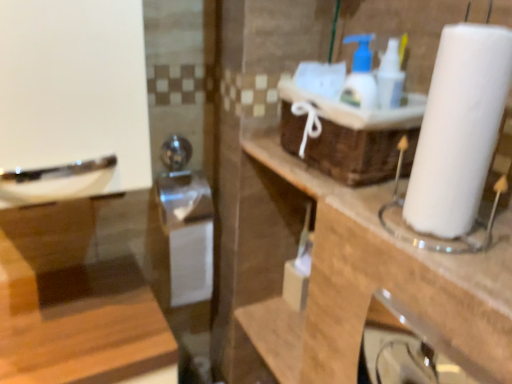
Question: Considering the relative positions of white paper at right and white paper towel at right in the image provided, is white paper at right behind white paper towel at right?

Choices:
 (A) yes
 (B) no

Answer: (B)

Question: Is white paper at right next to white paper towel at right and touching it?

Choices:
 (A) no
 (B) yes

Answer: (A)

Question: Does white paper at right have a lesser width compared to white paper towel at right?

Choices:
 (A) no
 (B) yes

Answer: (B)

Question: Is white paper at right not near white paper towel at right?

Choices:
 (A) no
 (B) yes

Answer: (A)

Question: From the image's perspective, is white paper at right below white paper towel at right?

Choices:
 (A) yes
 (B) no

Answer: (B)

Question: From the image's perspective, is white paper at right over white paper towel at right?

Choices:
 (A) no
 (B) yes

Answer: (B)

Question: Does white paper towel at right appear on the left side of brown woven basket at upper center?

Choices:
 (A) yes
 (B) no

Answer: (B)

Question: From the image's perspective, is white paper towel at right under brown woven basket at upper center?

Choices:
 (A) no
 (B) yes

Answer: (B)

Question: From a real-world perspective, does white paper towel at right stand above brown woven basket at upper center?

Choices:
 (A) no
 (B) yes

Answer: (A)

Question: Is white paper towel at right to the right of brown woven basket at upper center from the viewer's perspective?

Choices:
 (A) yes
 (B) no

Answer: (A)

Question: Is white paper towel at right oriented towards brown woven basket at upper center?

Choices:
 (A) no
 (B) yes

Answer: (A)

Question: Is white paper towel at right in front of brown woven basket at upper center?

Choices:
 (A) no
 (B) yes

Answer: (B)

Question: Does brown woven basket at upper center have a smaller size compared to white paper at right?

Choices:
 (A) no
 (B) yes

Answer: (A)